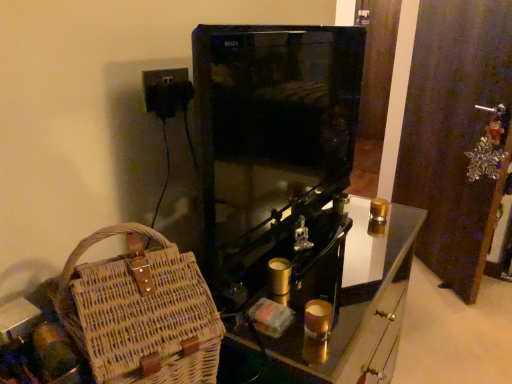
Question: Visually, is woven wood basket at lower left positioned to the left or to the right of metallic brown door at right?

Choices:
 (A) right
 (B) left

Answer: (B)

Question: Looking at their shapes, would you say woven wood basket at lower left is wider or thinner than metallic brown door at right?

Choices:
 (A) thin
 (B) wide

Answer: (B)

Question: Estimate the real-world distances between objects in this image. Which object is closer to the woven straw bag at lower left?

Choices:
 (A) woven wood basket at lower left
 (B) metallic brown door at right

Answer: (A)

Question: Estimate the real-world distances between objects in this image. Which object is farther from the metallic brown door at right?

Choices:
 (A) woven wood basket at lower left
 (B) woven straw bag at lower left

Answer: (B)